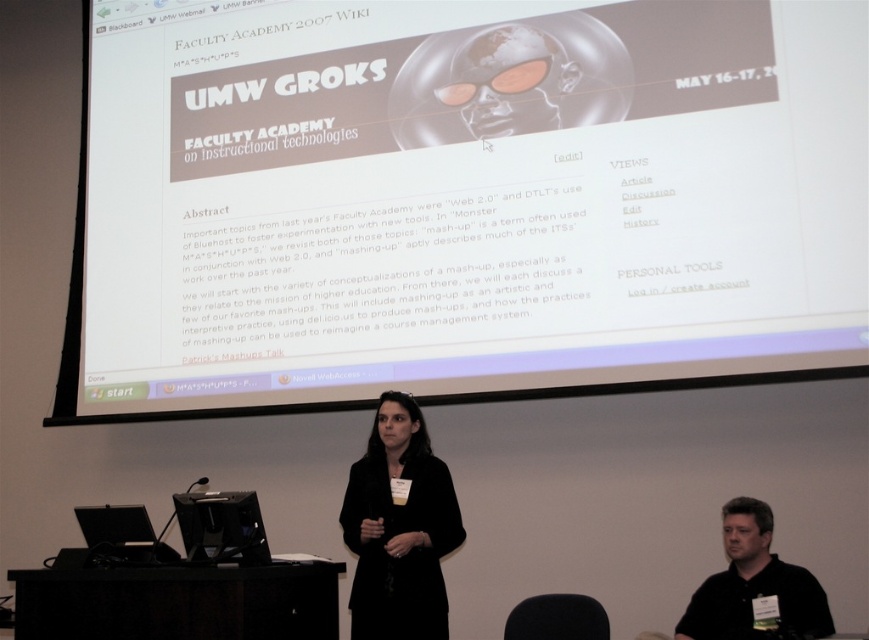
Based on the photo, what are the coordinates of the black matte jacket at center?

The coordinates of the black matte jacket at center are at point (399, 529).

You are sitting in the front row of the presentation and want to hand the presenter a note. The note is on a table 2 meters in front of you. Can you reach the black matte jacket at center from your current position without leaving your seat?

The black matte jacket at center is 3.30 meters away from the viewer. Since the note is only 2 meters in front of you, you cannot reach the black matte jacket at center as it is farther than the distance to the note.